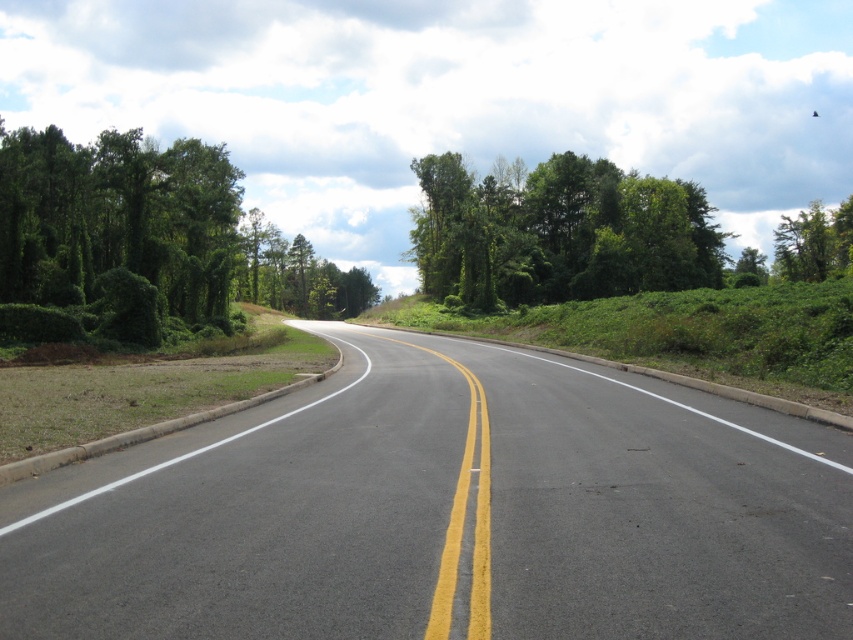
You are driving along the road and see the green leafy bush at left and the green leafy trees at upper center. Which object is closer to you as you drive?

The green leafy bush at left is closer to you because it is in front of the green leafy trees at upper center, meaning it is positioned nearer to your viewpoint while driving.

You are driving a car that is 2 meters wide. You need to navigate through the asphalt road at center while avoiding the green leafy bush at left. Can your car fit on the road without touching the bush?

The asphalt road at center has a lesser width compared to the green leafy bush at left. Since the road is narrower than the bush, it is possible that the car might not have enough space to safely pass without touching the bush. However, the exact width of the road isn not provided, so we cannot definitively determine if the 2 meter wide car can fit. More information about the road width is needed.

You are standing at the point with coordinates (x=445, y=513) in the image. Based on the scene description, what type of surface are you currently standing on?

The point at (x=445, y=513) corresponds to the asphalt road at center, so you are standing on asphalt.